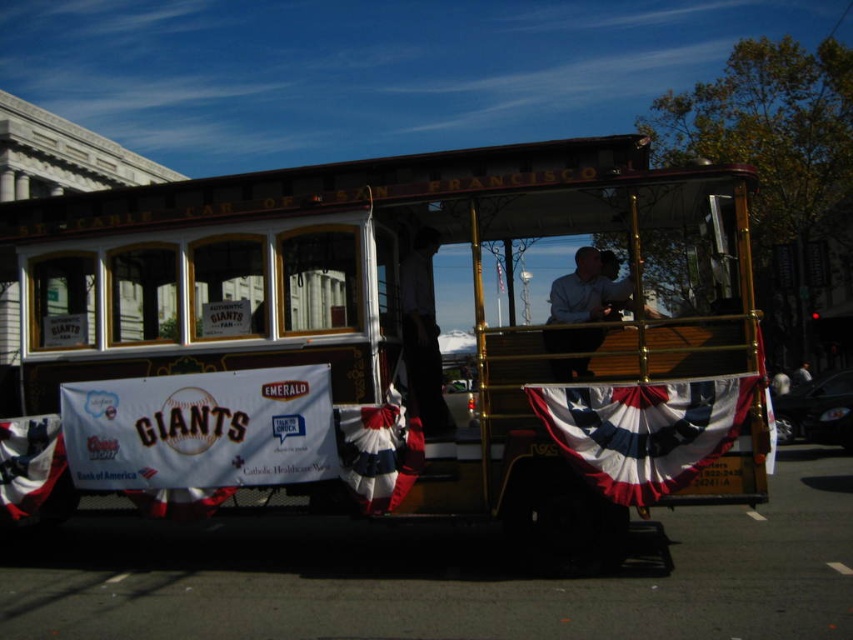
You are standing at the front of the San Francisco cable car and notice a point marked at coordinates (645, 429). What object is located at that point?

The point at coordinates (645, 429) corresponds to the red, white, and blue fabric banner at center.

Consider the image. You are standing on the sidewalk and see the wooden cable car at center and the light blue shirt at center. Which object is nearer to you?

The wooden cable car at center is closer to the viewer than the light blue shirt at center, so the wooden cable car at center is nearer to you.